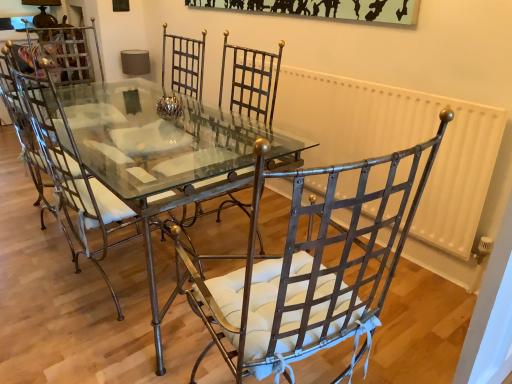
You are a GUI agent. You are given a task and a screenshot of the screen. Output one action in this format:
    pyautogui.click(x=<x>, y=<y>)
    Task: Click on the free space above white painted metal radiator at right (from a real-world perspective)
    The width and height of the screenshot is (512, 384).
    Given the screenshot: What is the action you would take?
    pyautogui.click(x=349, y=80)